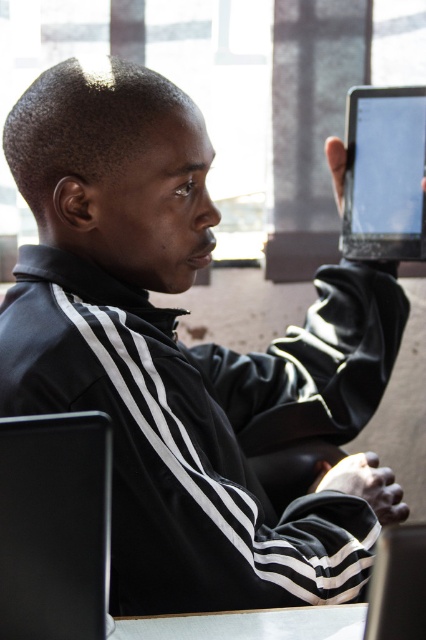
You are taking a photo of the scene and want to focus on both the point at (28, 611) and the point at (155, 628). Which point should you focus on first to ensure both are in focus?

You should focus on the point at (28, 611) first because it is closer to the camera than the point at (155, 628). This way, adjusting focus from the closer point outward can help both points be in focus.

You are organizing a tech fair and need to place two laptops side by side on a 1.2 meter wide table. The black matte laptop at lower left and the black glossy laptop at lower right are available. Can both fit side by side without overlapping?

The black matte laptop at lower left is wider than the black glossy laptop at lower right. If their combined widths exceed 1.2 meters, they won